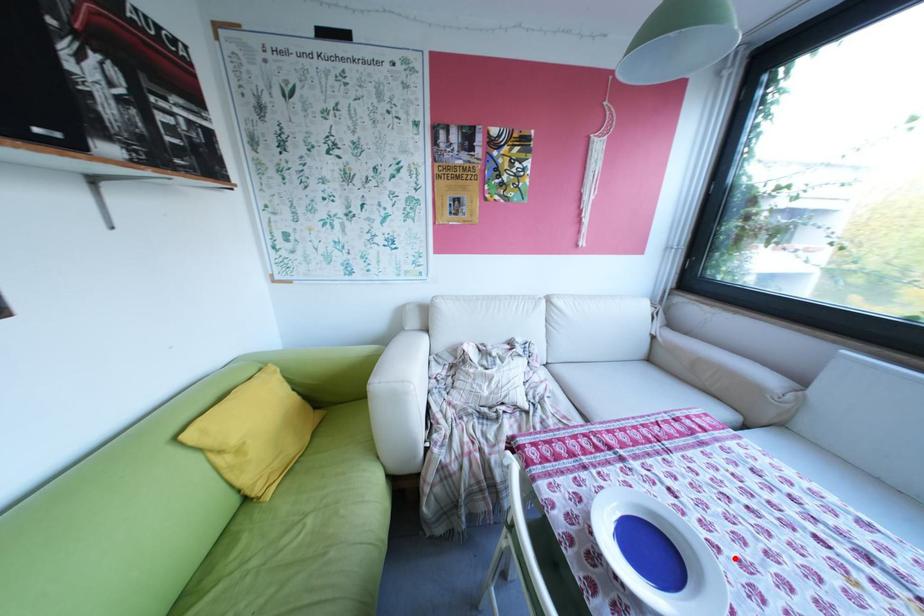
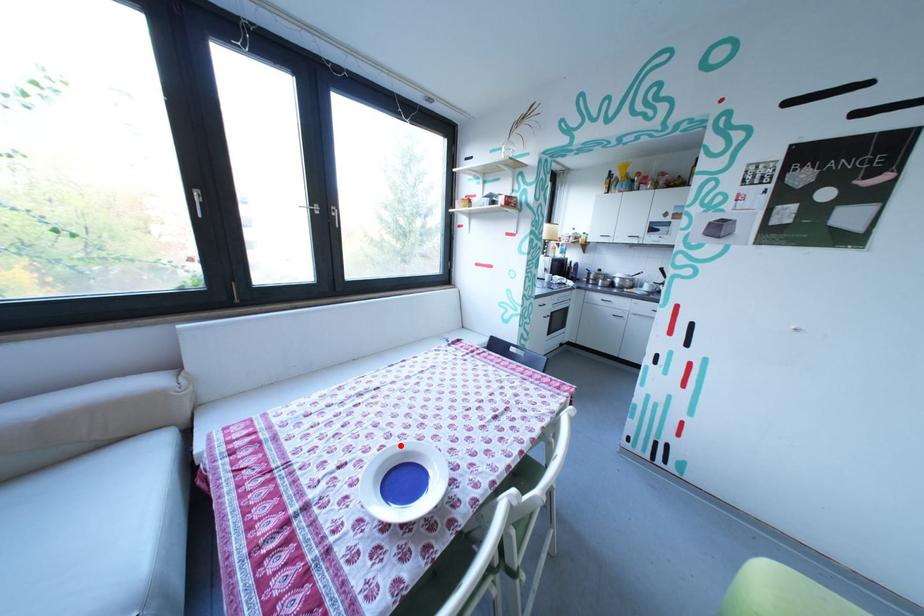
I am providing you with two images of the same scene from different viewpoints. A red point is marked on the first image and another point is marked on the second image. Do the highlighted points in image1 and image2 indicate the same real-world spot?

Yes